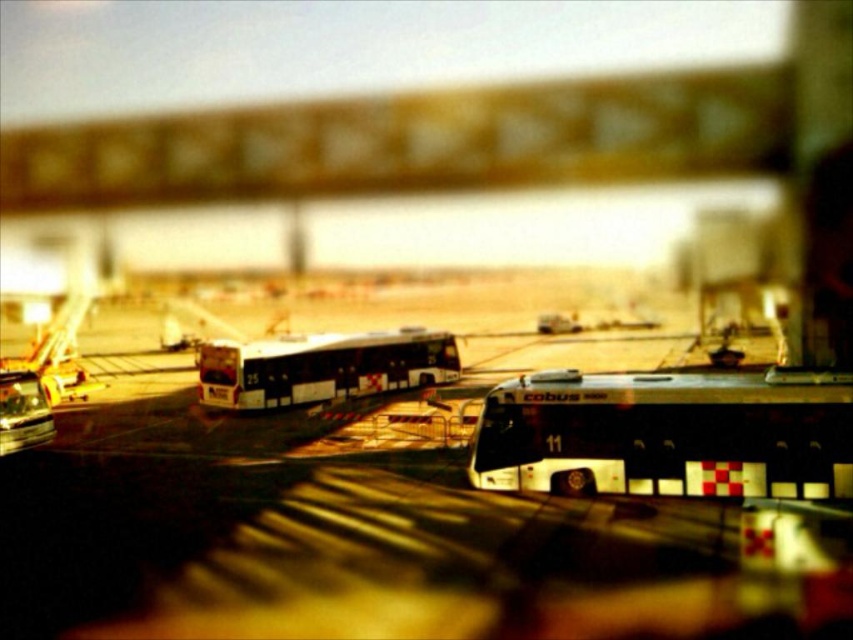
Does metallic signboard at upper center appear over white matte bus at center?

Yes.

Can you confirm if metallic signboard at upper center is bigger than white matte bus at center?

Correct, metallic signboard at upper center is larger in size than white matte bus at center.

Find the location of a particular element. metallic signboard at upper center is located at coordinates pos(410,141).

Where is `metallic signboard at upper center`? The width and height of the screenshot is (853, 640). metallic signboard at upper center is located at coordinates point(410,141).

Is point (544, 106) farther from camera compared to point (303, 337)?

Yes, it is.

Measure the distance between metallic signboard at upper center and white glossy bus at center.

A distance of 130.47 feet exists between metallic signboard at upper center and white glossy bus at center.

Does point (618, 132) come behind point (456, 368)?

Yes, point (618, 132) is behind point (456, 368).

At what (x,y) coordinates should I click in order to perform the action: click on metallic signboard at upper center. Please return your answer as a coordinate pair (x, y). Looking at the image, I should click on (410, 141).

Measure the distance between white matte bus at center and white glossy bus at center.

white matte bus at center and white glossy bus at center are 16.62 meters apart.

Is point (724, 432) positioned before point (215, 388)?

Yes, it is in front of point (215, 388).

Identify the location of white matte bus at center. This screenshot has width=853, height=640. (666, 435).